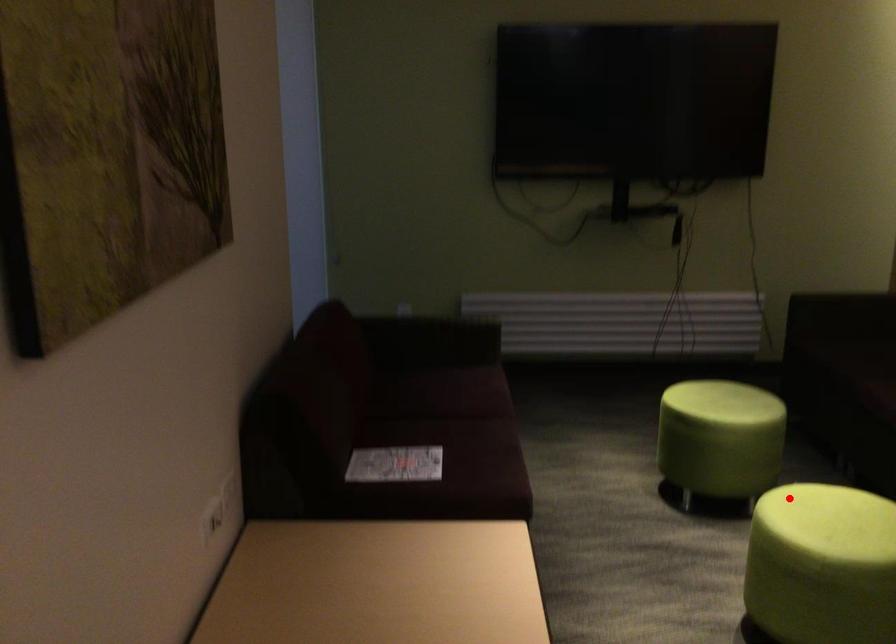
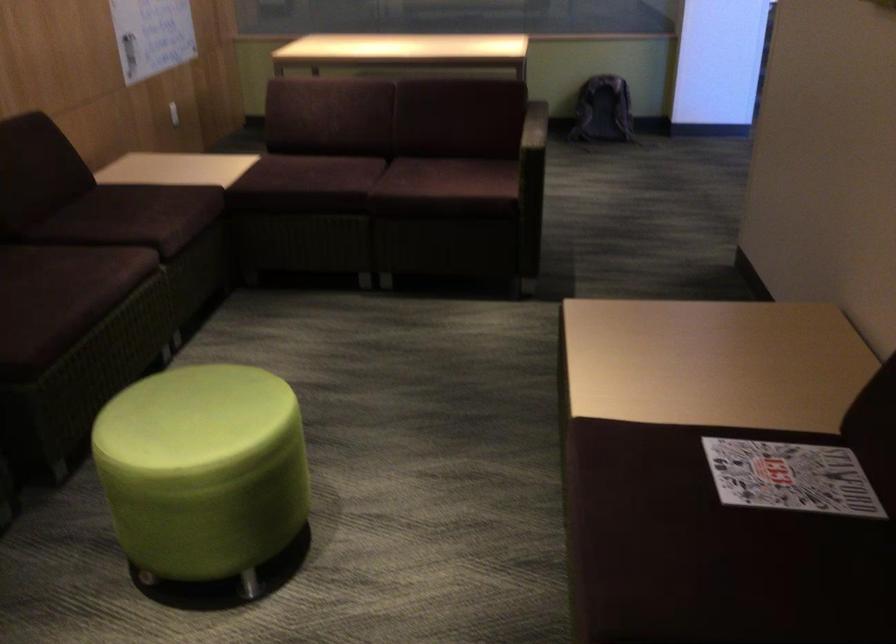
Locate, in the second image, the point that corresponds to the highlighted location in the first image.

(203, 471)